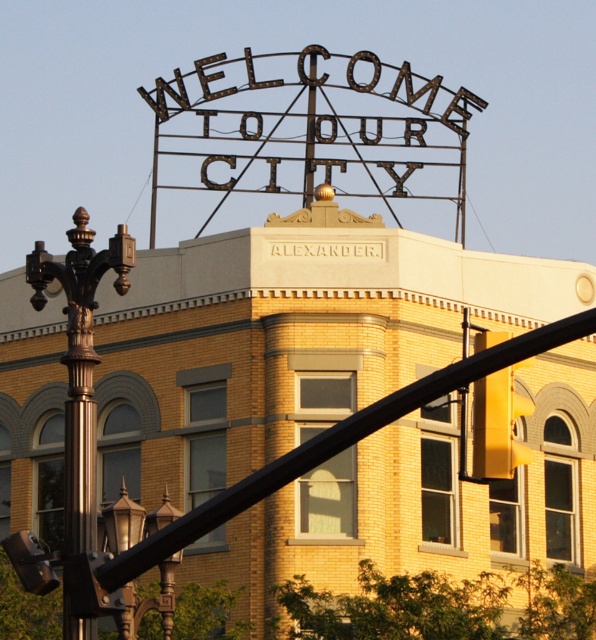
Does polished bronze street light at left have a greater width compared to yellow matte traffic light at center?

Yes, polished bronze street light at left is wider than yellow matte traffic light at center.

Is point (92, 308) farther from camera compared to point (513, 413)?

No, it is not.

The image size is (596, 640). I want to click on polished bronze street light at left, so click(79, 360).

Can you confirm if yellow matte traffic light at center is positioned below bronze textured street light at lower left?

Actually, yellow matte traffic light at center is above bronze textured street light at lower left.

Does yellow matte traffic light at center have a greater width compared to bronze textured street light at lower left?

No, yellow matte traffic light at center is not wider than bronze textured street light at lower left.

This screenshot has height=640, width=596. In order to click on yellow matte traffic light at center in this screenshot , I will do `click(498, 426)`.

Is polished bronze street light at left in front of bronze textured street light at lower left?

No, it is not.

Is point (91, 449) in front of point (128, 621)?

Yes, point (91, 449) is closer to viewer.

Identify the location of polished bronze street light at left. (79, 360).